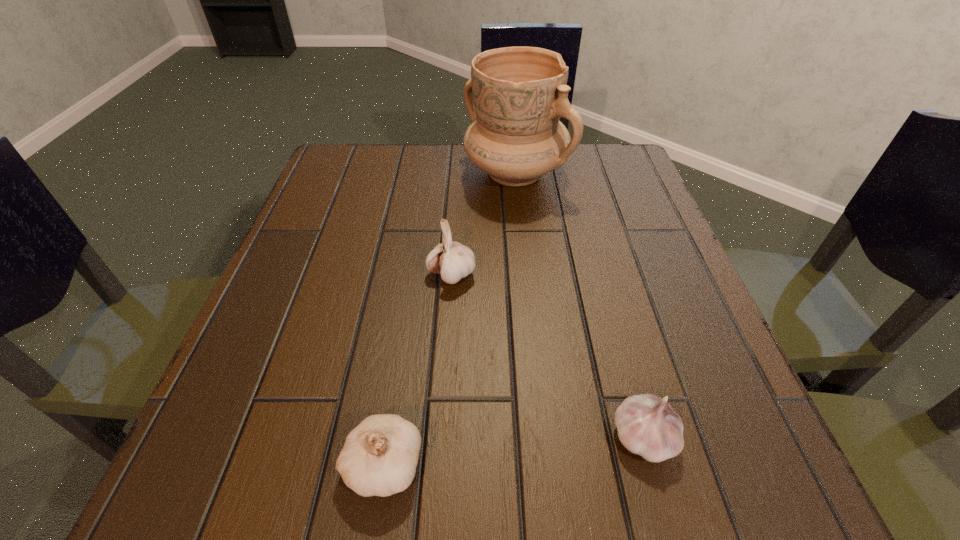
Image resolution: width=960 pixels, height=540 pixels. I want to click on the farthest object, so click(516, 95).

I want to click on the tallest object, so click(x=516, y=95).

At what (x,y) coordinates should I click in order to perform the action: click on the third nearest object. Please return your answer as a coordinate pair (x, y). This screenshot has width=960, height=540. Looking at the image, I should click on (454, 261).

What are the coordinates of `the rightmost garlic` in the screenshot? It's located at (647, 425).

Image resolution: width=960 pixels, height=540 pixels. In order to click on free space located 0.340m on the front of the pottery in this screenshot , I will do `click(532, 328)`.

Where is `free location located on the right of the farthest garlic`? Image resolution: width=960 pixels, height=540 pixels. free location located on the right of the farthest garlic is located at coordinates (526, 275).

What are the coordinates of `blank area located on the left of the rightmost garlic` in the screenshot? It's located at (566, 437).

Locate an element on the screen. object situated at the far edge is located at coordinates (516, 95).

Where is `object present at the right edge`? This screenshot has height=540, width=960. object present at the right edge is located at coordinates (647, 425).

Find the location of `object located at the near right corner`. object located at the near right corner is located at coordinates (647, 425).